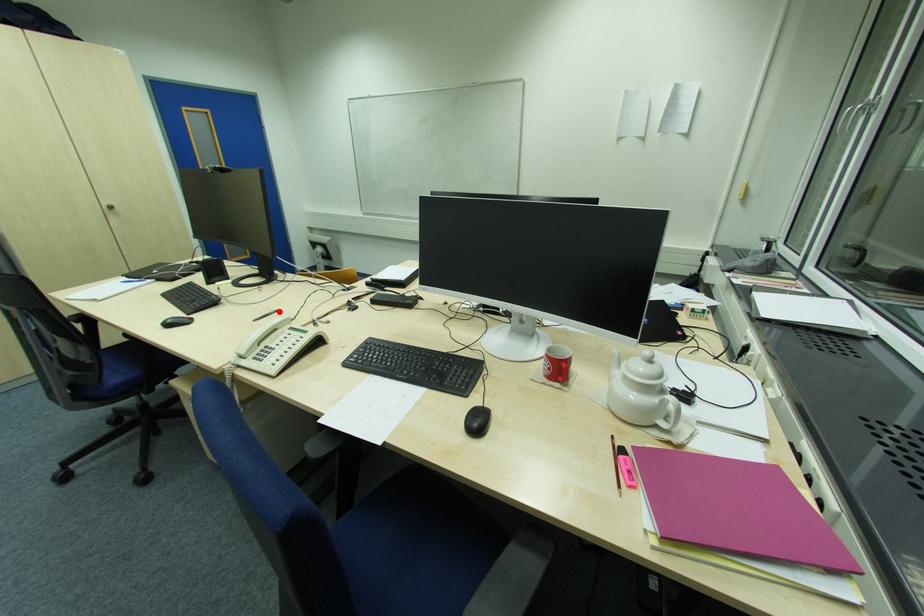
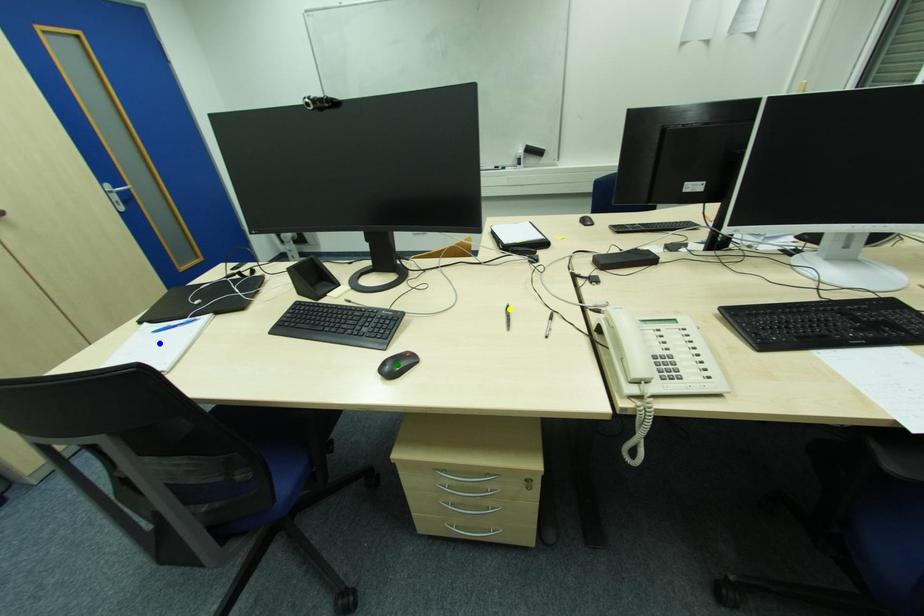
Question: I am providing you with two images of the same scene from different viewpoints. A red point is marked on the first image. You are given multiple points on the second image. Which mark in image 2 goes with the point in image 1?

Choices:
 (A) blue point
 (B) yellow point
 (C) green point

Answer: (B)